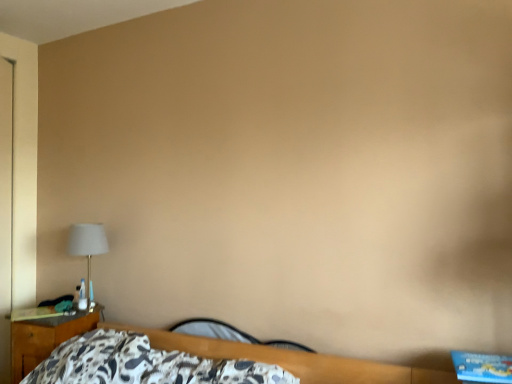
The height and width of the screenshot is (384, 512). What do you see at coordinates (45, 338) in the screenshot? I see `wooden nightstand at left` at bounding box center [45, 338].

This screenshot has height=384, width=512. Describe the element at coordinates (87, 249) in the screenshot. I see `matte white lampshade at left` at that location.

Consider the image. What is the approximate height of matte white lampshade at left?

19.94 inches.

The width and height of the screenshot is (512, 384). Identify the location of wooden nightstand at left. (45, 338).

Can you confirm if matte white lampshade at left is positioned to the right of black leather guitar at lower center?

No, matte white lampshade at left is not to the right of black leather guitar at lower center.

Is matte white lampshade at left situated inside black leather guitar at lower center or outside?

matte white lampshade at left exists outside the volume of black leather guitar at lower center.

Can you tell me how much matte white lampshade at left and black leather guitar at lower center differ in facing direction?

The angle between the facing direction of matte white lampshade at left and the facing direction of black leather guitar at lower center is 4.32 degrees.

From the image's perspective, which one is positioned lower, matte white lampshade at left or black leather guitar at lower center?

black leather guitar at lower center is shown below in the image.

Who is taller, matte white lampshade at left or wooden nightstand at left?

matte white lampshade at left is taller.

From the image's perspective, which one is positioned lower, matte white lampshade at left or wooden nightstand at left?

wooden nightstand at left.

Is matte white lampshade at left situated inside wooden nightstand at left or outside?

matte white lampshade at left is spatially situated outside wooden nightstand at left.

In the scene shown: From a real-world perspective, who is located lower, black leather guitar at lower center or wooden nightstand at left?

wooden nightstand at left, from a real-world perspective.

In the image, is black leather guitar at lower center positioned in front of or behind wooden nightstand at left?

Visually, black leather guitar at lower center is located in front of wooden nightstand at left.

From the image's perspective, relative to wooden nightstand at left, is black leather guitar at lower center above or below?

Clearly, from the image's perspective, black leather guitar at lower center is above wooden nightstand at left.

Consider the image. How different are the orientations of black leather guitar at lower center and wooden nightstand at left in degrees?

The angle between the facing direction of black leather guitar at lower center and the facing direction of wooden nightstand at left is 4.32 degrees.

Does wooden nightstand at left have a lesser width compared to matte white lampshade at left?

Incorrect, the width of wooden nightstand at left is not less than that of matte white lampshade at left.

Considering the relative sizes of wooden nightstand at left and matte white lampshade at left in the image provided, is wooden nightstand at left taller than matte white lampshade at left?

→ No.

From the picture: From a real-world perspective, is wooden nightstand at left beneath matte white lampshade at left?

Correct, in the physical world, wooden nightstand at left is lower than matte white lampshade at left.

Considering the sizes of objects wooden nightstand at left and matte white lampshade at left in the image provided, who is bigger, wooden nightstand at left or matte white lampshade at left?

Bigger between the two is wooden nightstand at left.

Find the location of `chair on the right of wooden nightstand at left`. chair on the right of wooden nightstand at left is located at coordinates (229, 333).

From the image's perspective, does wooden nightstand at left appear higher than black leather guitar at lower center?

Incorrect, from the image's perspective, wooden nightstand at left is lower than black leather guitar at lower center.

Looking at this image, how different are the orientations of wooden nightstand at left and black leather guitar at lower center in degrees?

4.32 degrees.

Is black leather guitar at lower center turned away from matte white lampshade at left?

No, black leather guitar at lower center's orientation is not away from matte white lampshade at left.

Considering their positions, is black leather guitar at lower center located in front of or behind matte white lampshade at left?

Clearly, black leather guitar at lower center is in front of matte white lampshade at left.

Choose the correct answer: Is black leather guitar at lower center inside matte white lampshade at left or outside it?

The correct answer is: outside.

From a real-world perspective, which is physically above, black leather guitar at lower center or matte white lampshade at left?

matte white lampshade at left is physically above.

Identify the location of lamp on the left of the black leather guitar at lower center. The height and width of the screenshot is (384, 512). (87, 249).

Identify the location of lamp on the right side of wooden nightstand at left. This screenshot has width=512, height=384. (87, 249).

Which object lies further to the anchor point black leather guitar at lower center, matte white lampshade at left or wooden nightstand at left?

matte white lampshade at left.

Looking at the image, which one is located further to matte white lampshade at left, wooden nightstand at left or black leather guitar at lower center?

Among the two, black leather guitar at lower center is located further to matte white lampshade at left.

Considering their positions, is wooden nightstand at left positioned closer to black leather guitar at lower center than matte white lampshade at left?

wooden nightstand at left is positioned closer to the anchor black leather guitar at lower center.

When comparing their distances from matte white lampshade at left, does black leather guitar at lower center or wooden nightstand at left seem further?

Among the two, black leather guitar at lower center is located further to matte white lampshade at left.

Based on their spatial positions, is matte white lampshade at left or black leather guitar at lower center further from wooden nightstand at left?

black leather guitar at lower center is positioned further to the anchor wooden nightstand at left.

Based on their spatial positions, is black leather guitar at lower center or matte white lampshade at left further from wooden nightstand at left?

Among the two, black leather guitar at lower center is located further to wooden nightstand at left.

Locate an element on the screen. The height and width of the screenshot is (384, 512). lamp located between wooden nightstand at left and black leather guitar at lower center in the left-right direction is located at coordinates (87, 249).